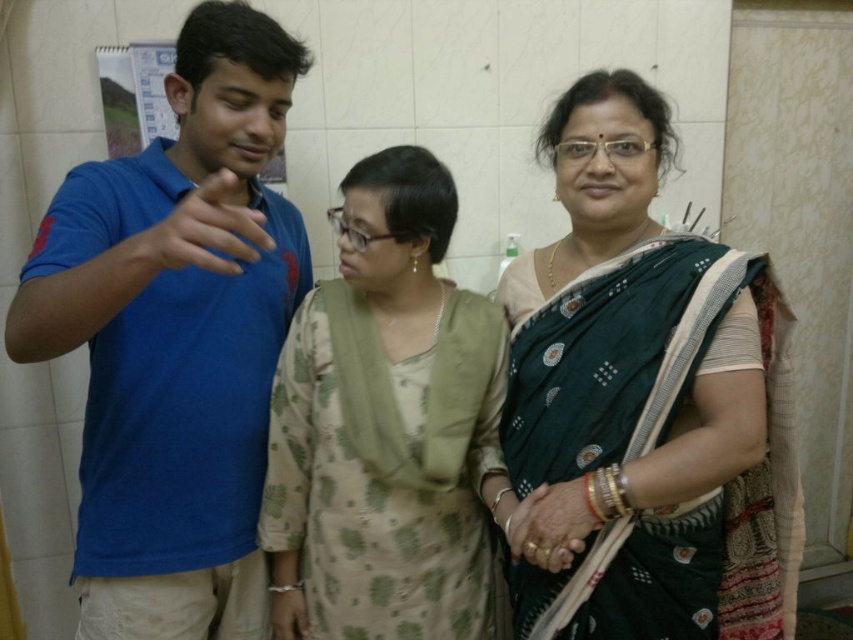
You are planning to buy a new outfit and want to ensure it matches your existing wardrobe. You have the green silk saree at center and the blue cotton shirt at left. Which one is wider so that it can be paired with a wider range of accessories?

The green silk saree at center is wider than the blue cotton shirt at left, so it can be paired with a wider range of accessories.

You are planning to take a photo of the green silk saree at center and the blue cotton shirt at left. Which one should you focus on first if you want to capture both in the frame without moving the camera?

The green silk saree at center is positioned on the right side of blue cotton shirt at left, so you should focus on the blue cotton shirt at left first to ensure both are in the frame.